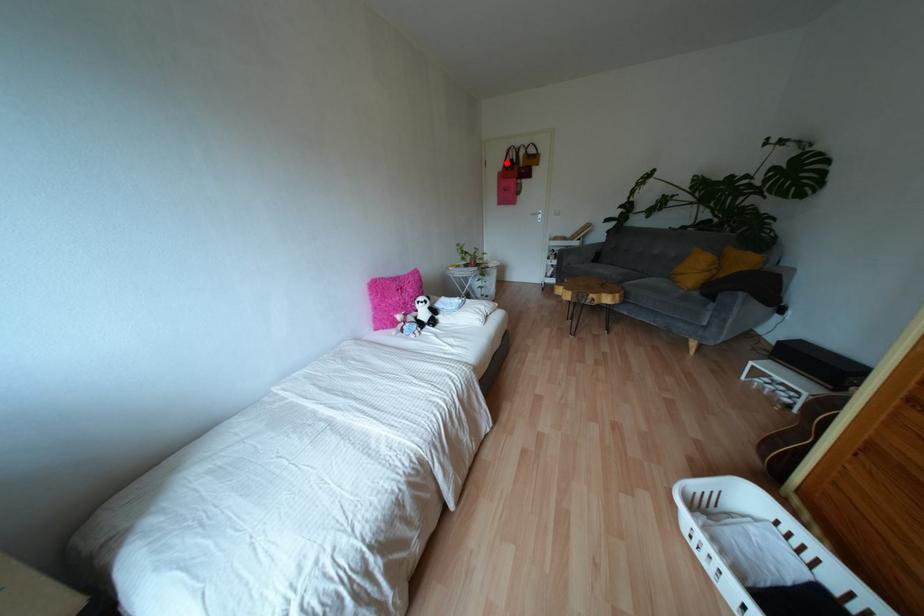
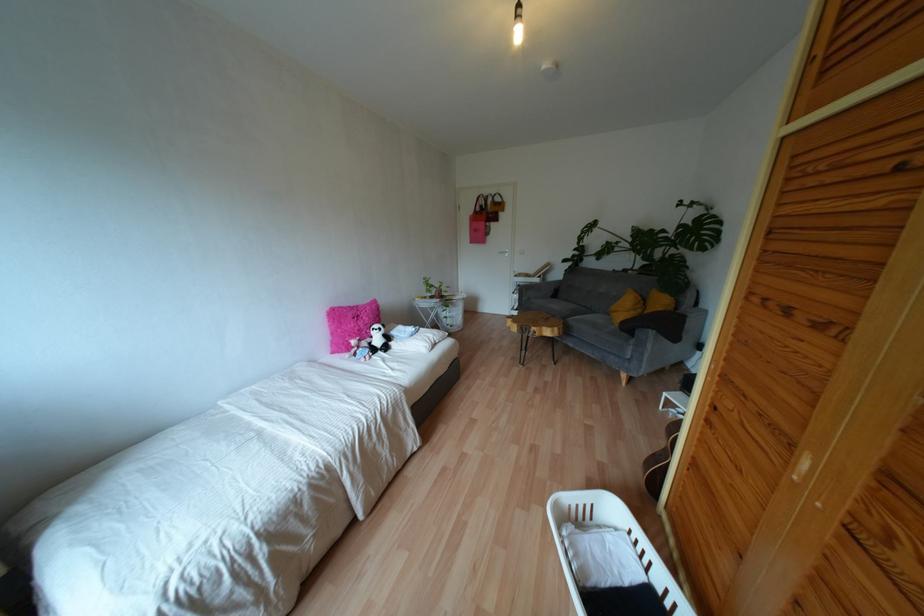
In the second image, find the point that corresponds to the highlighted location in the first image.

(477, 208)